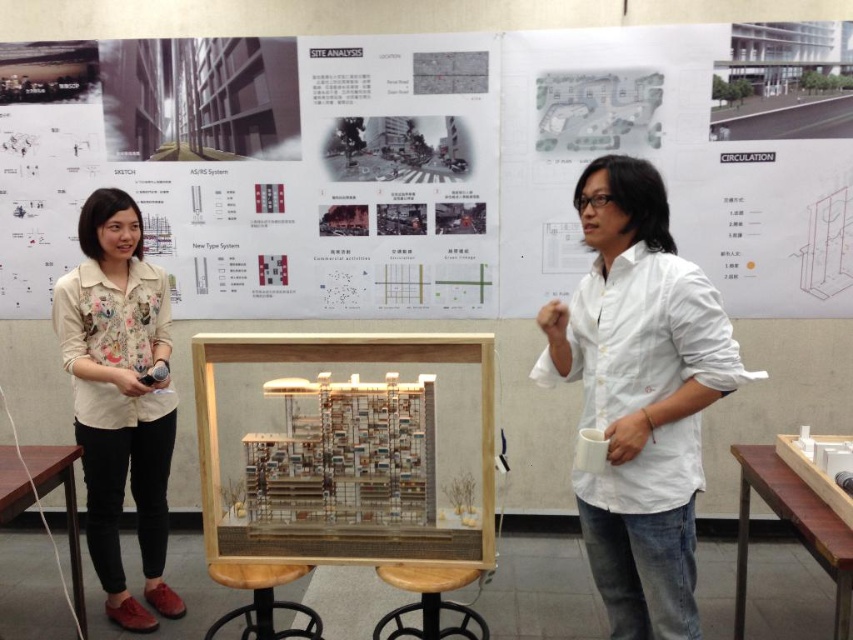
Question: Which point is closer to the camera?

Choices:
 (A) (421, 611)
 (B) (653, 330)

Answer: (B)

Question: Can you confirm if white cotton shirt at center is bigger than wooden frame at center?

Choices:
 (A) no
 (B) yes

Answer: (B)

Question: Among these objects, which one is nearest to the camera?

Choices:
 (A) floral print shirt at left
 (B) wooden frame at center

Answer: (B)

Question: Does white cotton shirt at center appear over wooden stool at center?

Choices:
 (A) no
 (B) yes

Answer: (B)

Question: Is floral print shirt at left to the right of wooden frame at center from the viewer's perspective?

Choices:
 (A) yes
 (B) no

Answer: (B)

Question: Which object appears farthest from the camera in this image?

Choices:
 (A) floral print shirt at left
 (B) wooden frame at center
 (C) white cotton shirt at center

Answer: (A)